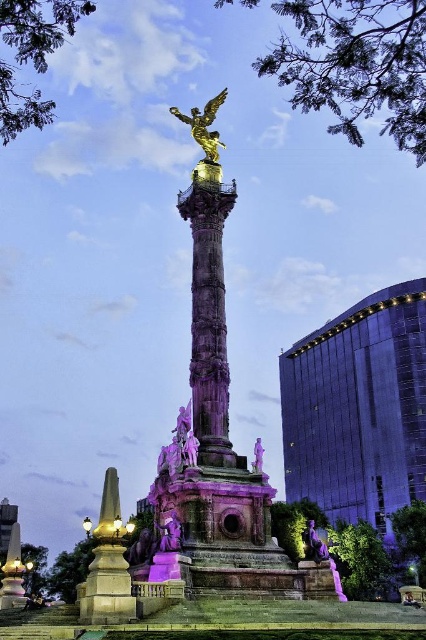
At what (x,y) coordinates should I click in order to perform the action: click on gold metallic angel at upper center. Please return your answer as a coordinate pair (x, y). This screenshot has height=640, width=426. Looking at the image, I should click on (204, 125).

Is gold metallic angel at upper center shorter than purple stone statue at center?

No, gold metallic angel at upper center is not shorter than purple stone statue at center.

Is point (199, 113) behind point (164, 518)?

That is True.

The width and height of the screenshot is (426, 640). Find the location of `gold metallic angel at upper center`. gold metallic angel at upper center is located at coordinates (204, 125).

Who is positioned more to the left, polished stone column at center or gold metallic angel at upper center?

gold metallic angel at upper center is more to the left.

Which is in front, point (207, 429) or point (215, 148)?

Positioned in front is point (207, 429).

Between point (212, 419) and point (226, 88), which one is positioned in front?

Positioned in front is point (212, 419).

The height and width of the screenshot is (640, 426). Find the location of `polished stone column at center`. polished stone column at center is located at coordinates (209, 321).

Is glossy glass building at right above purple stone statue at center?

Yes, glossy glass building at right is above purple stone statue at center.

From the picture: Can you confirm if glossy glass building at right is bigger than purple stone statue at center?

Correct, glossy glass building at right is larger in size than purple stone statue at center.

The image size is (426, 640). Identify the location of glossy glass building at right. (359, 410).

Find the location of a particular element. glossy glass building at right is located at coordinates (359, 410).